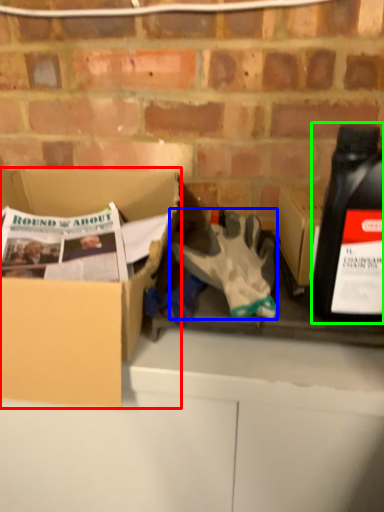
Question: Which is nearer to the box (highlighted by a red box)? glove (highlighted by a blue box) or bottle (highlighted by a green box).

Choices:
 (A) glove
 (B) bottle

Answer: (A)